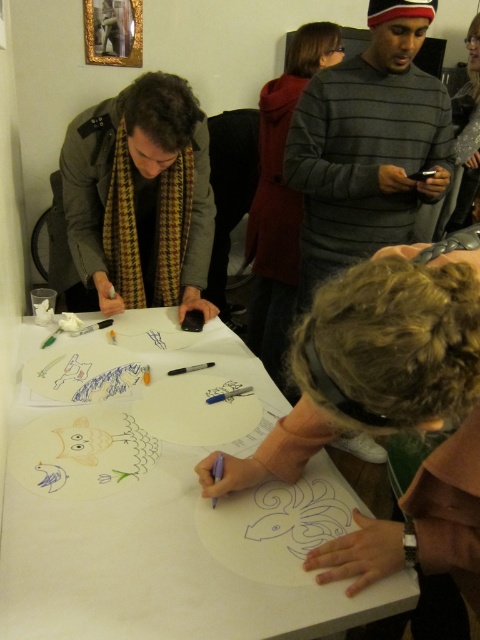
Question: Which point is closer to the camera?

Choices:
 (A) (135, 100)
 (B) (274, 109)

Answer: (A)

Question: Does blue ink fish at center have a smaller size compared to black marker pen at center?

Choices:
 (A) yes
 (B) no

Answer: (B)

Question: Can you confirm if red woolen coat at upper center is positioned below yellow wax crayon at center?

Choices:
 (A) yes
 (B) no

Answer: (B)

Question: Which of the following is the closest to the observer?

Choices:
 (A) yellow wax crayon at center
 (B) blonde hair at center
 (C) plaid scarf at center
 (D) smooth gray sweater at upper right

Answer: (B)

Question: Estimate the real-world distances between objects in this image. Which object is farther from the black marker pen at center?

Choices:
 (A) red woolen coat at upper center
 (B) smooth gray sweater at upper right
 (C) blue ink fish at center

Answer: (B)

Question: Does blue ink fish at center appear on the left side of black marker pen at center?

Choices:
 (A) yes
 (B) no

Answer: (B)